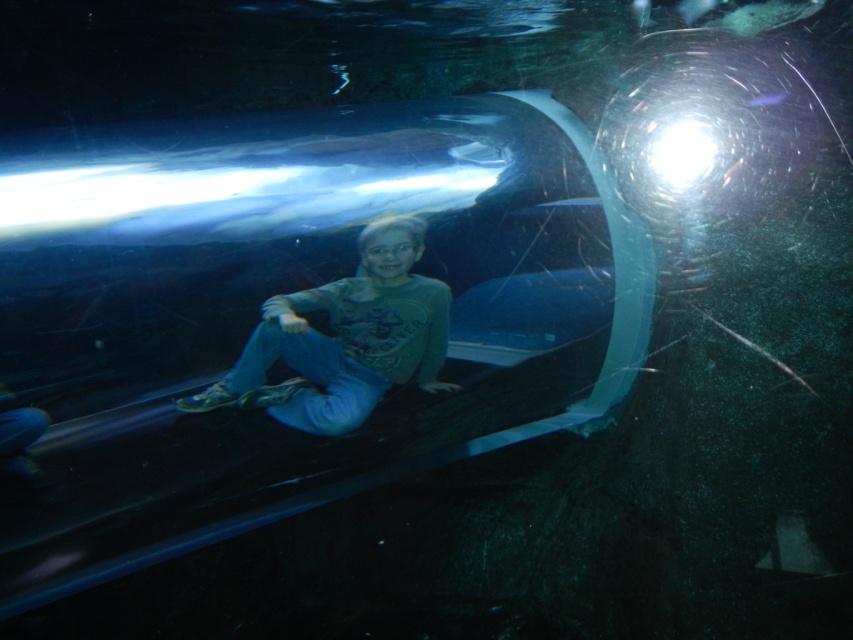
Question: Where is matte gray shirt at center located in relation to transparent glass bubble at upper center in the image?

Choices:
 (A) right
 (B) left

Answer: (B)

Question: Is matte gray shirt at center below transparent glass bubble at upper center?

Choices:
 (A) no
 (B) yes

Answer: (B)

Question: Is matte gray shirt at center bigger than transparent glass bubble at upper center?

Choices:
 (A) yes
 (B) no

Answer: (A)

Question: Which of the following is the farthest from the observer?

Choices:
 (A) transparent glass bubble at upper center
 (B) matte gray shirt at center

Answer: (A)

Question: Which of the following is the closest to the observer?

Choices:
 (A) matte gray shirt at center
 (B) transparent glass bubble at upper center

Answer: (A)